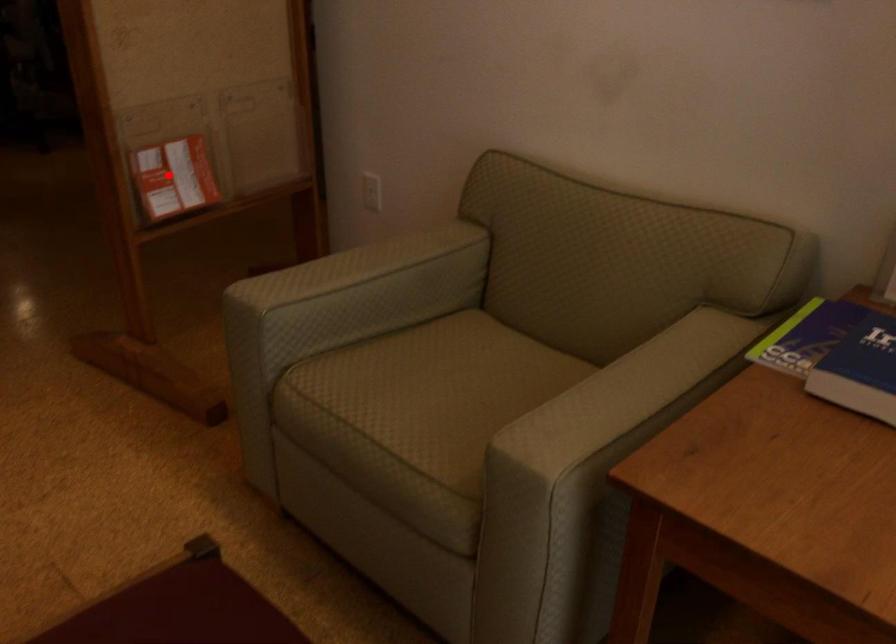
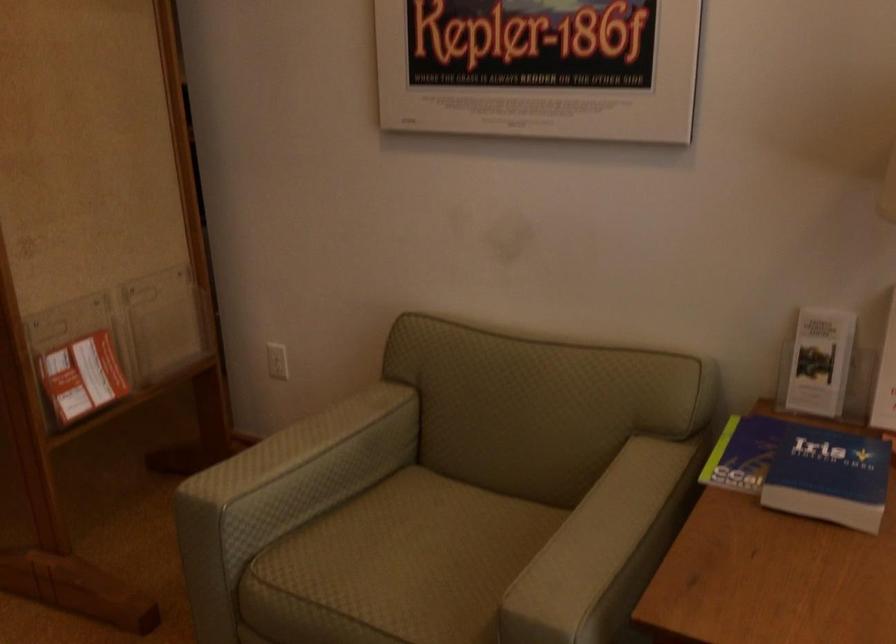
The point at the highlighted location is marked in the first image. Where is the corresponding point in the second image?

(82, 377)